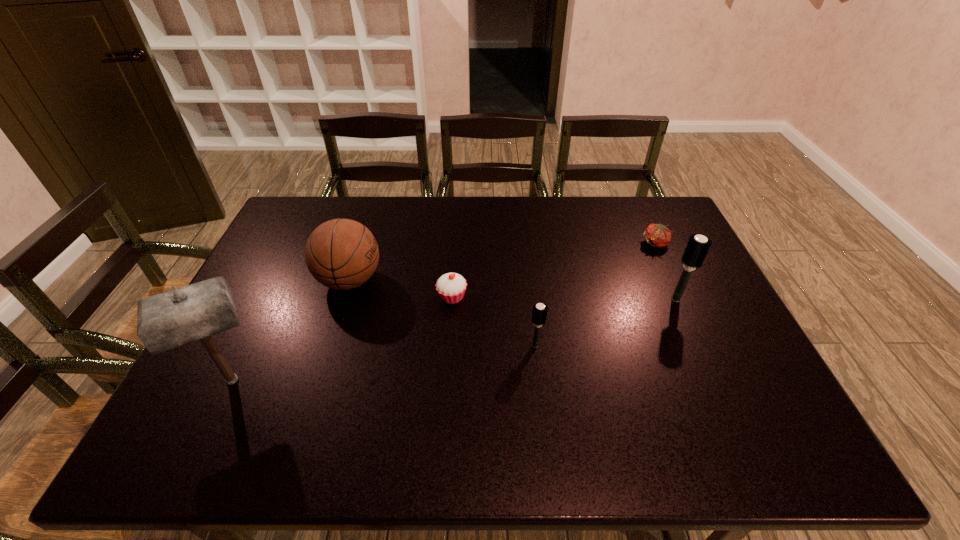
I want to click on free area in between the third object from right to left and the shortest object, so click(x=595, y=295).

Choose which object is the nearest neighbor to the leftmost object. Please provide its 2D coordinates. Your answer should be formatted as a tuple, i.e. [(x, y)], where the tuple contains the x and y coordinates of a point satisfying the conditions above.

[(342, 254)]

Select which object is the fourth closest to the left hairbrush. Please provide its 2D coordinates. Your answer should be formatted as a tuple, i.e. [(x, y)], where the tuple contains the x and y coordinates of a point satisfying the conditions above.

[(657, 235)]

This screenshot has height=540, width=960. In order to click on free space that satisfies the following two spatial constraints: 1. on the side with brand label of the basketball; 2. on the back side of the fifth tallest object in this screenshot , I will do `click(345, 297)`.

What are the coordinates of `vacant area in the image that satisfies the following two spatial constraints: 1. on the back side of the cupcake; 2. on the left side of the leftmost object` in the screenshot? It's located at (272, 297).

Where is `blank area in the image that satisfies the following two spatial constraints: 1. on the side with brand label of the basketball; 2. on the left side of the fourth object from left to right`? The height and width of the screenshot is (540, 960). blank area in the image that satisfies the following two spatial constraints: 1. on the side with brand label of the basketball; 2. on the left side of the fourth object from left to right is located at coordinates (329, 346).

Where is `vacant region that satisfies the following two spatial constraints: 1. on the front side of the left hairbrush; 2. on the left side of the second shortest object`? This screenshot has height=540, width=960. vacant region that satisfies the following two spatial constraints: 1. on the front side of the left hairbrush; 2. on the left side of the second shortest object is located at coordinates (449, 346).

Locate an element on the screen. vacant space that satisfies the following two spatial constraints: 1. on the side with brand label of the basketball; 2. on the front side of the nearest object is located at coordinates (318, 380).

Locate an element on the screen. The height and width of the screenshot is (540, 960). vacant space that satisfies the following two spatial constraints: 1. on the side with brand label of the shorter hairbrush; 2. on the left side of the second object from left to right is located at coordinates (329, 346).